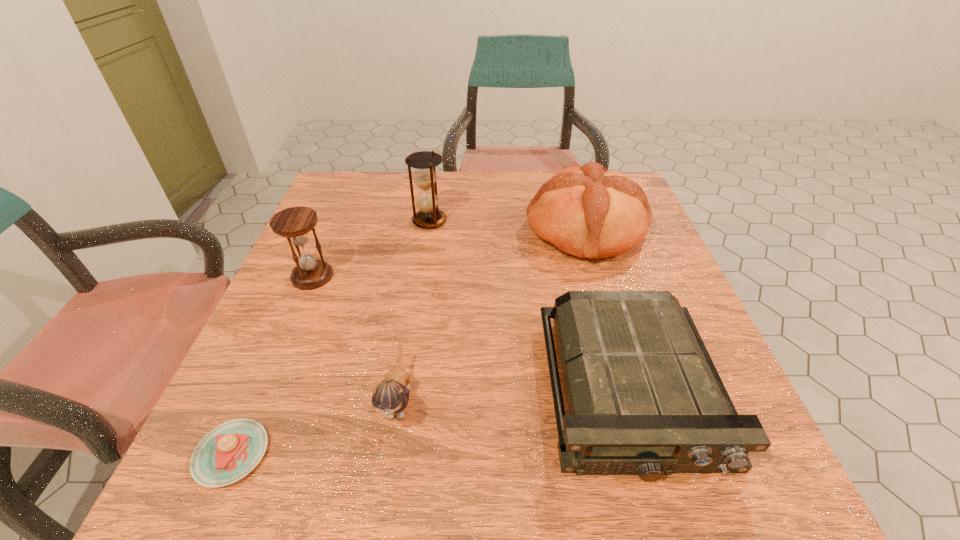
Identify the location of object that is at the far right corner. The height and width of the screenshot is (540, 960). (587, 211).

What are the coordinates of `object situated at the near right corner` in the screenshot? It's located at (644, 397).

At what (x,y) coordinates should I click in order to perform the action: click on vacant area at the far edge of the desktop. Please return your answer as a coordinate pair (x, y). Looking at the image, I should click on (439, 173).

You are a GUI agent. You are given a task and a screenshot of the screen. Output one action in this format:
    pyautogui.click(x=<x>, y=<y>)
    Task: Click on the vacant region at the near edge of the desktop
    This screenshot has width=960, height=540.
    Given the screenshot: What is the action you would take?
    point(577,483)

Locate an element on the screen. This screenshot has height=540, width=960. vacant point at the left edge is located at coordinates (323, 221).

Find the location of a particular element. The height and width of the screenshot is (540, 960). vacant space at the right edge is located at coordinates (651, 264).

You are a GUI agent. You are given a task and a screenshot of the screen. Output one action in this format:
    pyautogui.click(x=<x>, y=<y>)
    Task: Click on the vacant space at the far left corner of the desktop
    This screenshot has height=540, width=960.
    Given the screenshot: What is the action you would take?
    pyautogui.click(x=319, y=204)

Where is `vacant space at the near left corner of the desktop`? This screenshot has width=960, height=540. vacant space at the near left corner of the desktop is located at coordinates (206, 503).

Where is `vacant space that's between the bread and the pastry`? The width and height of the screenshot is (960, 540). vacant space that's between the bread and the pastry is located at coordinates (409, 342).

This screenshot has width=960, height=540. Find the location of `empty location between the shortest object and the radio receiver`. empty location between the shortest object and the radio receiver is located at coordinates (431, 422).